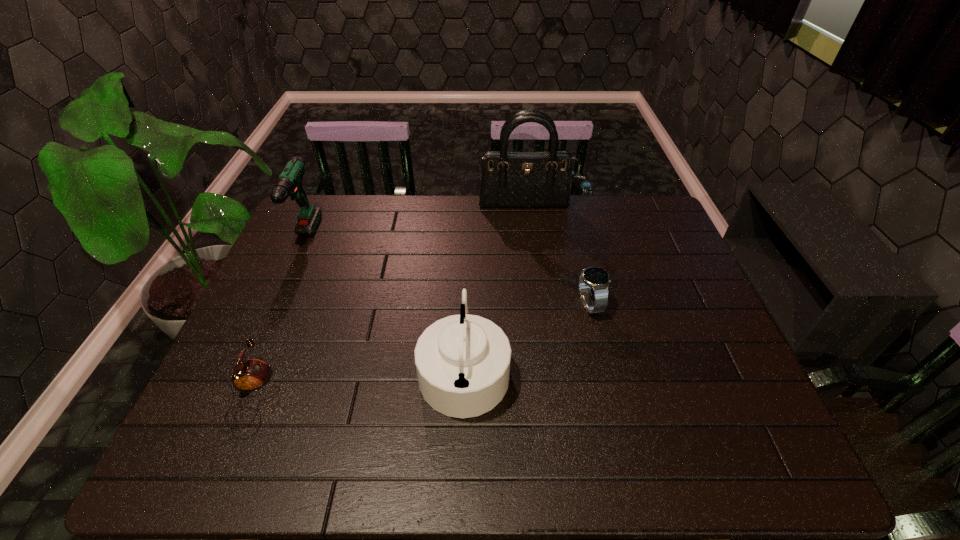
Where is `vacant space in between the watch and the tallest object`? The height and width of the screenshot is (540, 960). vacant space in between the watch and the tallest object is located at coordinates (558, 255).

The width and height of the screenshot is (960, 540). Find the location of `free space between the second shortest object and the farthest object`. free space between the second shortest object and the farthest object is located at coordinates (558, 255).

Identify the location of unoccupied position between the drill and the kettle. The image size is (960, 540). (384, 304).

The height and width of the screenshot is (540, 960). Identify the location of free space between the drill and the kettle. (384, 304).

In order to click on free space between the fourth shortest object and the tallest object in this screenshot , I will do `click(415, 223)`.

Find the location of `object that is the second nearest to the shortest object`. object that is the second nearest to the shortest object is located at coordinates (x=289, y=183).

This screenshot has height=540, width=960. Find the location of `the third closest object to the third nearest object`. the third closest object to the third nearest object is located at coordinates (251, 375).

You are a GUI agent. You are given a task and a screenshot of the screen. Output one action in this format:
    pyautogui.click(x=<x>, y=<y>)
    Task: Click on the vacant region that satisfies the following two spatial constraints: 1. with an open clasp on the front of the tallest object; 2. on the spout of the third shortest object
    The width and height of the screenshot is (960, 540).
    Given the screenshot: What is the action you would take?
    pyautogui.click(x=546, y=368)

Find the location of a particular element. vacant space that satisfies the following two spatial constraints: 1. with an open clasp on the front of the tallest object; 2. on the left side of the fourth tallest object is located at coordinates (539, 305).

This screenshot has width=960, height=540. I want to click on vacant space that satisfies the following two spatial constraints: 1. with an open clasp on the front of the handbag; 2. on the rotary dial of the telephone, so click(550, 396).